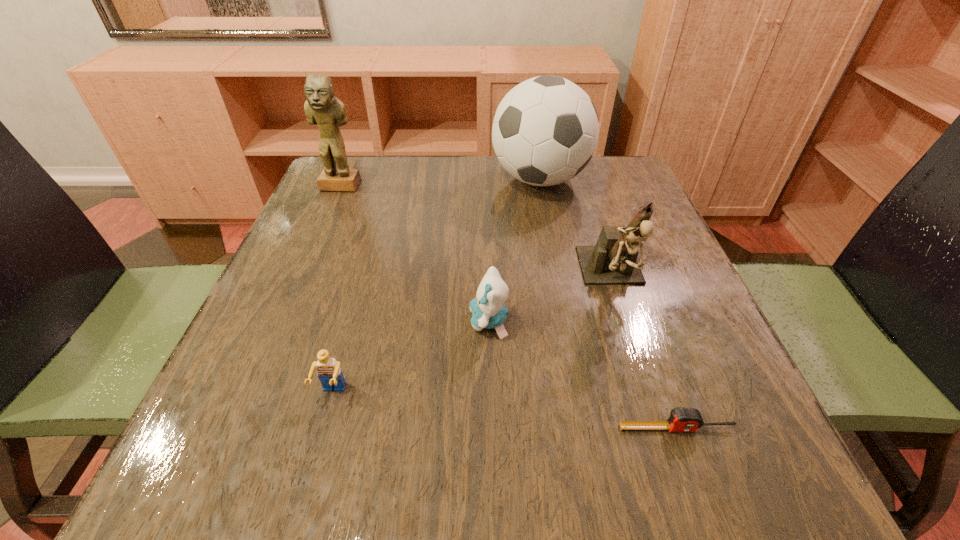
Where is `blank region between the soccer ball and the leftmost object`? blank region between the soccer ball and the leftmost object is located at coordinates (440, 183).

The image size is (960, 540). I want to click on free space between the shortest object and the nearer figurine, so [645, 353].

The image size is (960, 540). I want to click on free area in between the soccer ball and the second shortest object, so click(436, 287).

The height and width of the screenshot is (540, 960). What are the coordinates of `vacant space in between the tape measure and the second nearest object` in the screenshot? It's located at (505, 411).

You are a GUI agent. You are given a task and a screenshot of the screen. Output one action in this format:
    pyautogui.click(x=<x>, y=<y>)
    Task: Click on the vacant space in between the fourth tallest object and the left figurine
    The image size is (960, 540).
    Given the screenshot: What is the action you would take?
    pyautogui.click(x=415, y=254)

Locate an element on the screen. The height and width of the screenshot is (540, 960). the fifth closest object to the third shortest object is located at coordinates (322, 108).

Locate which object ranks second in proximity to the leftmost object. Please provide its 2D coordinates. Your answer should be formatted as a tuple, i.e. [(x, y)], where the tuple contains the x and y coordinates of a point satisfying the conditions above.

[(488, 310)]

Image resolution: width=960 pixels, height=540 pixels. Identify the location of blank space that satisfies the following two spatial constraints: 1. on the front-facing side of the nearer figurine; 2. on the face of the third shortest object. (627, 321).

Image resolution: width=960 pixels, height=540 pixels. Identify the location of vacant point that satisfies the following two spatial constraints: 1. on the face of the kitten; 2. on the left side of the tape measure. (491, 428).

The image size is (960, 540). Find the location of `free location that satisfies the following two spatial constraints: 1. on the back side of the nearest object; 2. on the face of the kitten`. free location that satisfies the following two spatial constraints: 1. on the back side of the nearest object; 2. on the face of the kitten is located at coordinates (639, 321).